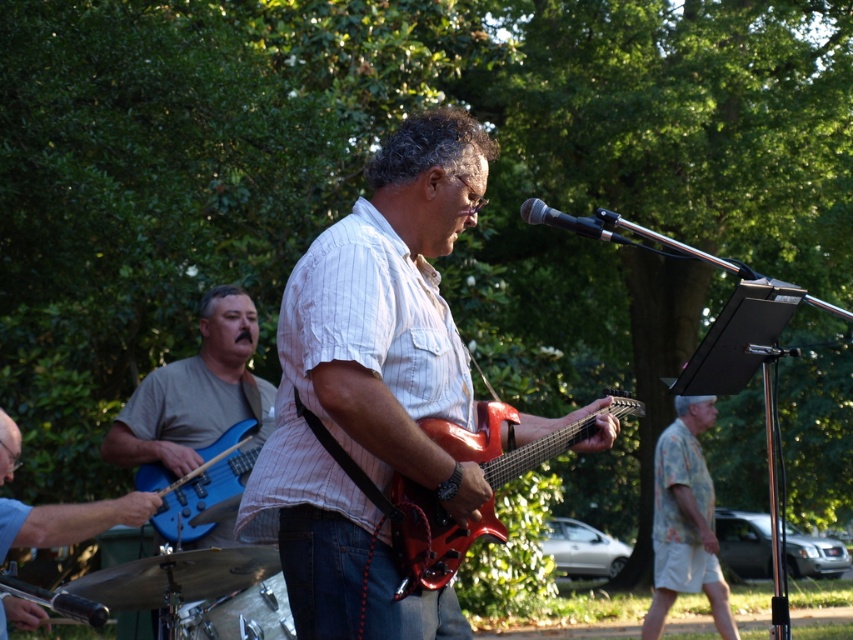
Does point (491, 445) come farther from viewer compared to point (213, 518)?

That is False.

The width and height of the screenshot is (853, 640). What do you see at coordinates (432, 536) in the screenshot?
I see `glossy red electric guitar at center` at bounding box center [432, 536].

At what (x,y) coordinates should I click in order to perform the action: click on glossy red electric guitar at center. Please return your answer as a coordinate pair (x, y). Looking at the image, I should click on (432, 536).

Which of these two, floral print shirt at center or black metallic microphone at upper center, stands shorter?

With less height is black metallic microphone at upper center.

Describe the element at coordinates (685, 520) in the screenshot. I see `floral print shirt at center` at that location.

What do you see at coordinates (685, 520) in the screenshot? I see `floral print shirt at center` at bounding box center [685, 520].

Locate an element on the screen. This screenshot has width=853, height=640. floral print shirt at center is located at coordinates (685, 520).

Which is in front, point (201, 410) or point (247, 332)?

Point (201, 410) is more forward.

I want to click on matte blue guitar at left, so click(195, 392).